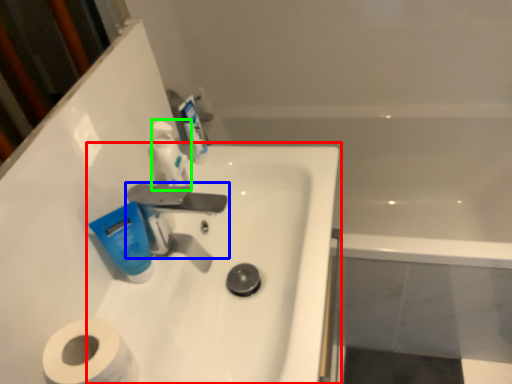
Question: Which object is the closest to the sink (highlighted by a red box)? Choose among these: tap (highlighted by a blue box) or toiletry (highlighted by a green box).

Choices:
 (A) tap
 (B) toiletry

Answer: (A)